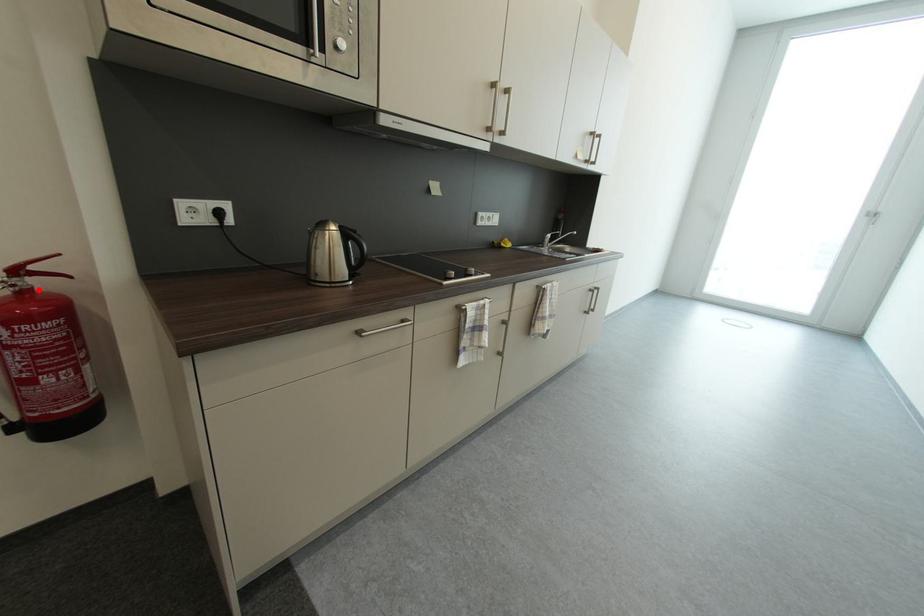
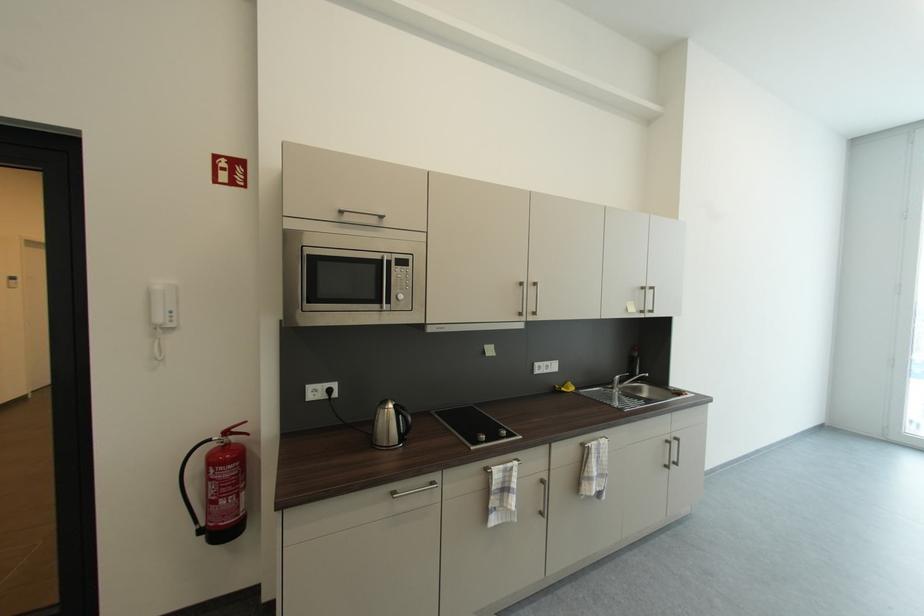
Locate, in the second image, the point that corresponds to the highlighted location in the first image.

(237, 444)